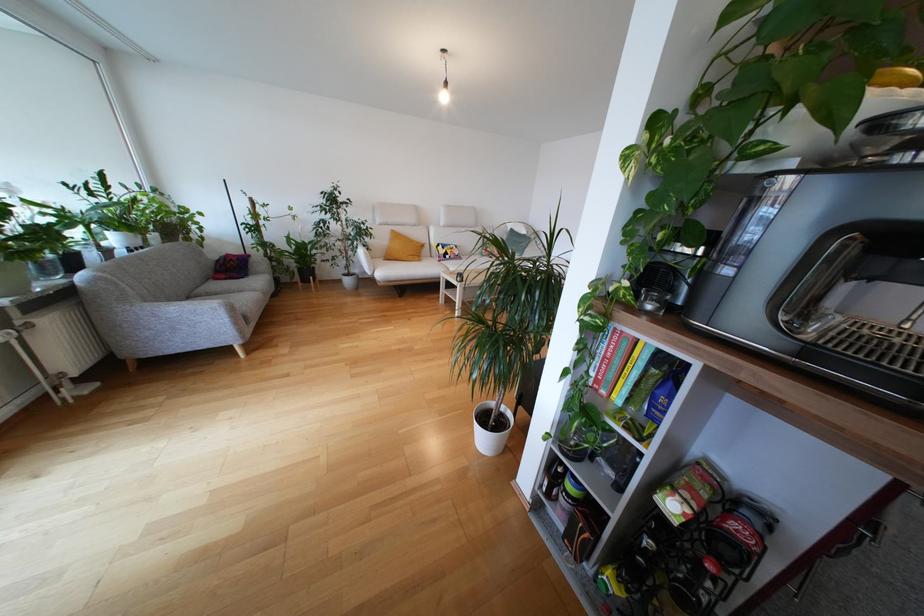
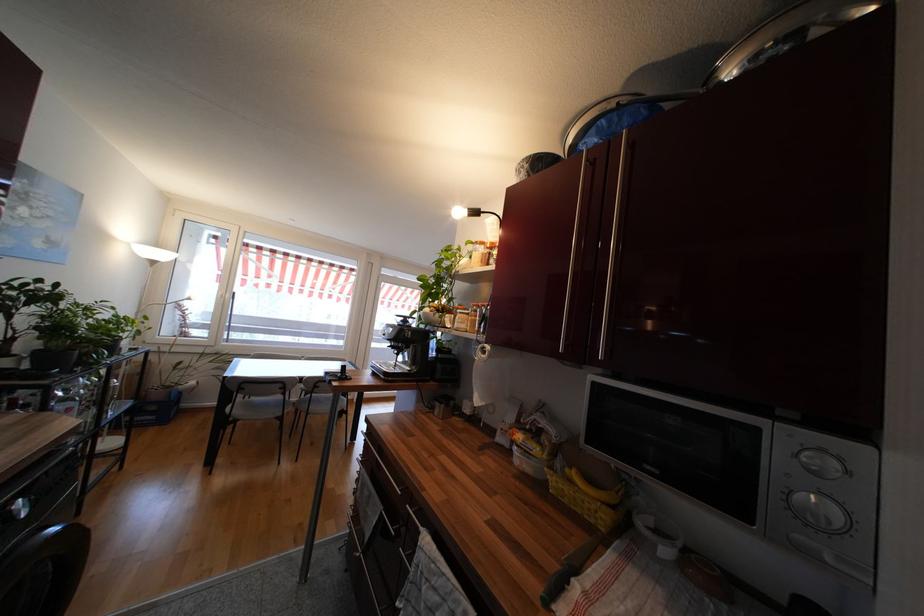
Question: I am providing you with two images of the same scene from different viewpoints. After the viewpoint changes to image2, which objects are now occluded?

Choices:
 (A) jar lid
 (B) light bulb
 (C) blue plastic crate
 (D) orange plastic cup

Answer: (B)